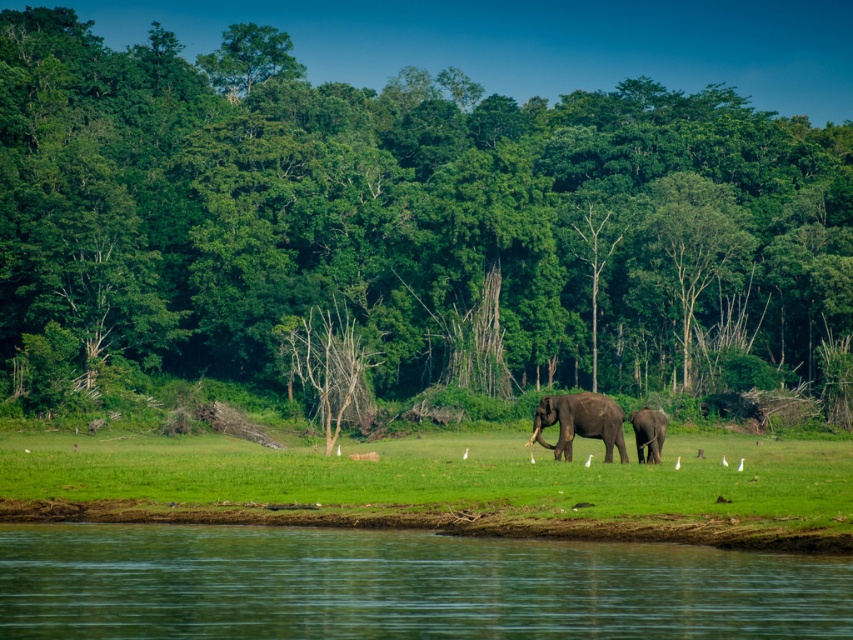
Question: Which of these objects is positioned closest to the dead wood tree at center?

Choices:
 (A) gray textured elephant at center
 (B) green smooth water at lower center
 (C) green grassy field at center

Answer: (C)

Question: Is green leafy tree at center positioned in front of green grassy field at center?

Choices:
 (A) no
 (B) yes

Answer: (A)

Question: Which object is positioned closest to the green leafy tree at center?

Choices:
 (A) green smooth water at lower center
 (B) gray textured elephant at center
 (C) dead wood tree at center

Answer: (C)

Question: Does green grassy field at center have a lesser width compared to brown textured elephant at center?

Choices:
 (A) yes
 (B) no

Answer: (B)

Question: Which of the following is the farthest from the observer?

Choices:
 (A) brown textured elephant at center
 (B) green leafy tree at center
 (C) green smooth water at lower center
 (D) green grassy field at center

Answer: (B)

Question: Is green leafy tree at center behind gray textured elephant at center?

Choices:
 (A) yes
 (B) no

Answer: (A)